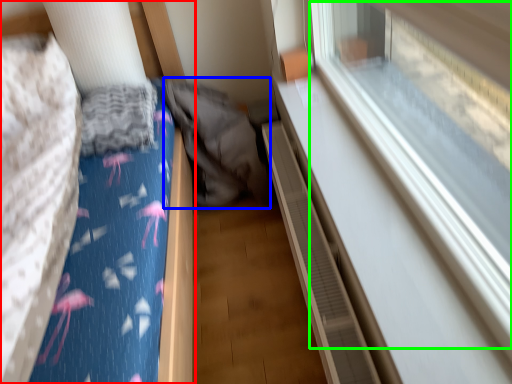
Question: Which is farther away from furniture (highlighted by a red box)? sleeping bag (highlighted by a blue box) or train window (highlighted by a green box)?

Choices:
 (A) sleeping bag
 (B) train window

Answer: (B)